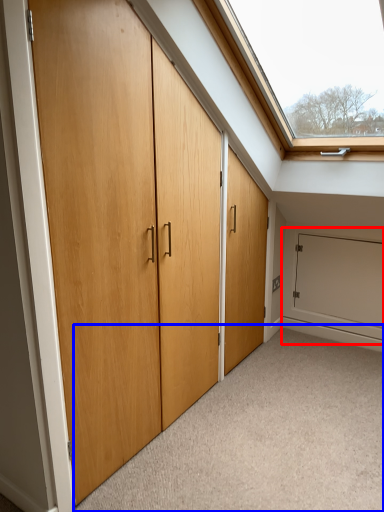
Question: Which of the following is the closest to the observer, garage door (highlighted by a red box) or plain (highlighted by a blue box)?

Choices:
 (A) garage door
 (B) plain

Answer: (B)